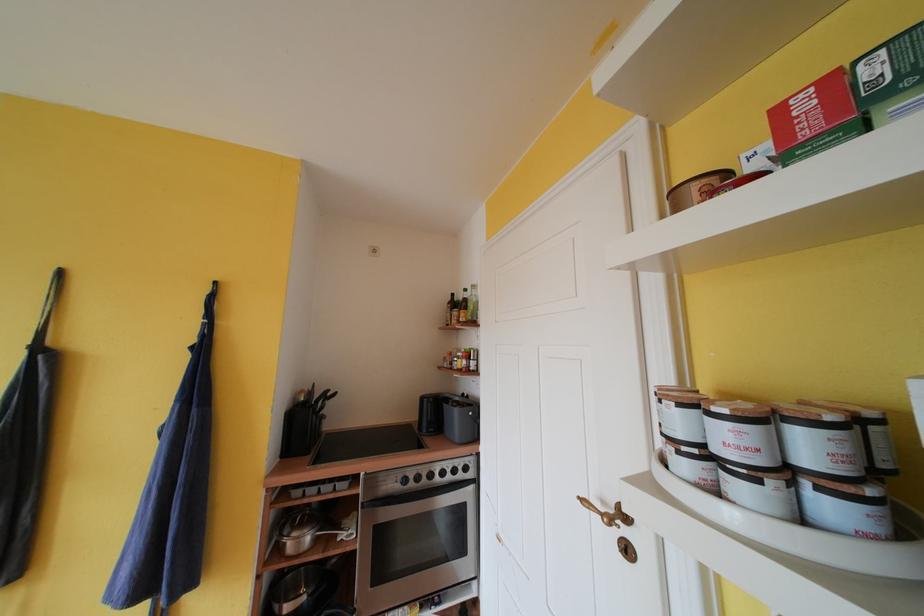
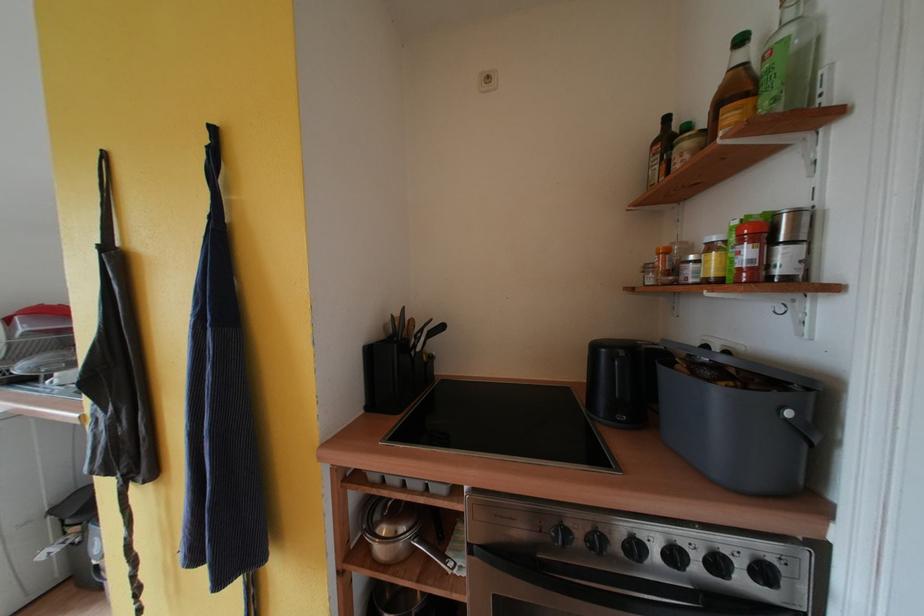
Find the pixel in the second image that matches (x=470, y=365) in the first image.

(755, 256)